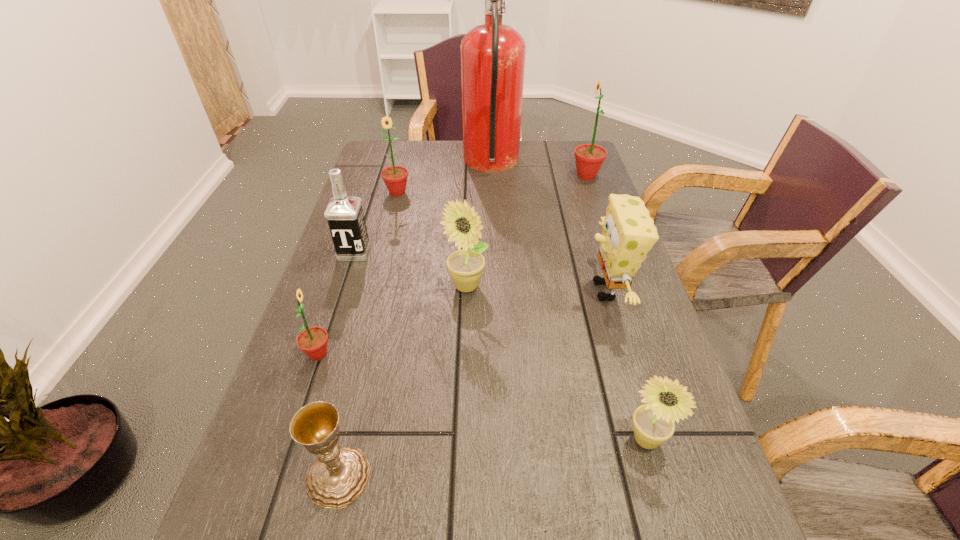
You are a GUI agent. You are given a task and a screenshot of the screen. Output one action in this format:
    pyautogui.click(x=<x>, y=<y>)
    Task: Click on the free space that satisfies the following two spatial constraints: 1. on the front label of the chalice; 2. on the right side of the vodka
    The height and width of the screenshot is (540, 960).
    Given the screenshot: What is the action you would take?
    pyautogui.click(x=281, y=477)

Locate an element on the screen. The image size is (960, 540). free spot that satisfies the following two spatial constraints: 1. with the handle and nozzle on the red fire extinguisher; 2. on the face of the third nearest sunflower is located at coordinates (496, 286).

The image size is (960, 540). In order to click on free space that satisfies the following two spatial constraints: 1. on the face of the second farthest green sunflower; 2. on the left side of the gold chalice in this screenshot , I will do `click(325, 477)`.

Find the location of a particular element. The height and width of the screenshot is (540, 960). blank area in the image that satisfies the following two spatial constraints: 1. on the face of the rightmost green sunflower; 2. on the face of the third sunflower from left to right is located at coordinates (624, 286).

Locate an element on the screen. free spot that satisfies the following two spatial constraints: 1. with the handle and nozzle on the red fire extinguisher; 2. on the face of the second green sunflower from left to right is located at coordinates (492, 192).